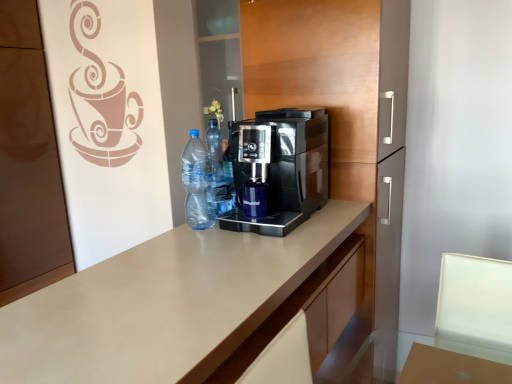
Where is `free space above beige laminate countertop at center (from a real-world perspective)`? The height and width of the screenshot is (384, 512). free space above beige laminate countertop at center (from a real-world perspective) is located at coordinates (169, 278).